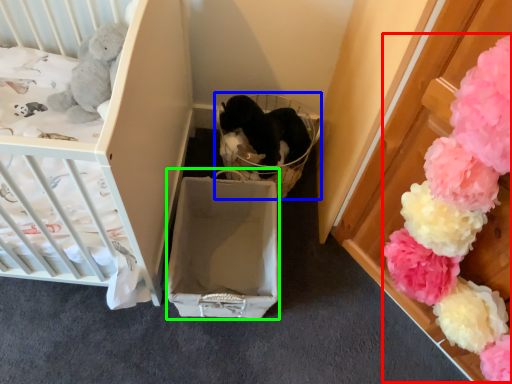
Question: Estimate the real-world distances between objects in this image. Which object is farther from flower (highlighted by a red box), baby carriage (highlighted by a blue box) or cardboard box (highlighted by a green box)?

Choices:
 (A) baby carriage
 (B) cardboard box

Answer: (A)